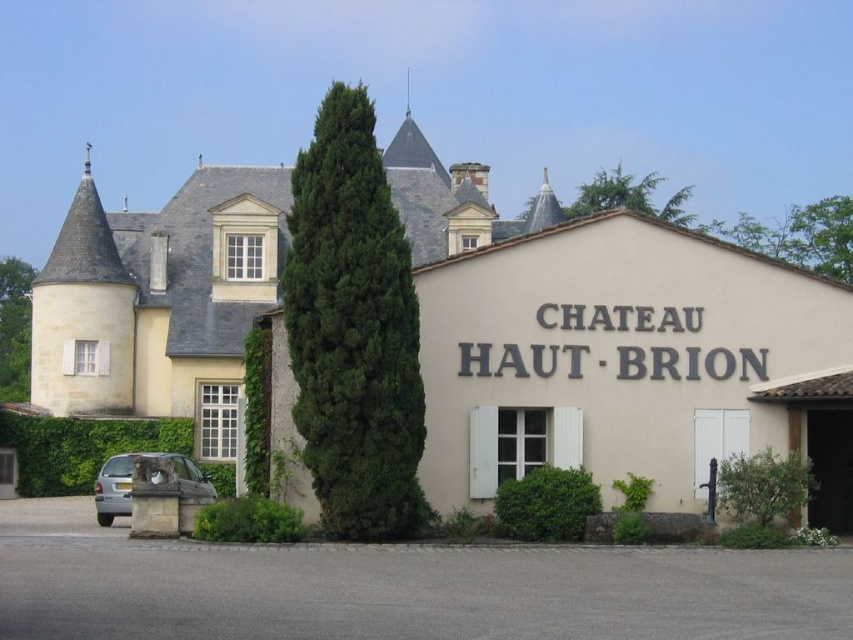
You are a photographer planning to take a wide shot of the beige stone building at center and the silver metallic car at lower left. Given that the camera can only capture objects within a 10 meter width, will both objects fit in the frame if the camera is positioned to include both?

The beige stone building at center is larger in size than the silver metallic car at lower left. However, the camera can capture objects within a 10 meter width. Since the question does not provide specific measurements of the objects or their distance from the camera, it is impossible to determine if both will fit in the frame based on the given information.

You are standing at the entrance of Chateaau Haut Brion and want to walk from point (184, 225) to point (125, 460). Which direction should you move in order to reach your destination?

To move from point (184, 225) to point (125, 460), you should move forward because point (184, 225) is behind point (125, 460).

You are standing at the point with coordinates point (160, 301). Which object is directly behind you?

The beige stone building at center is directly behind the point (160, 301).